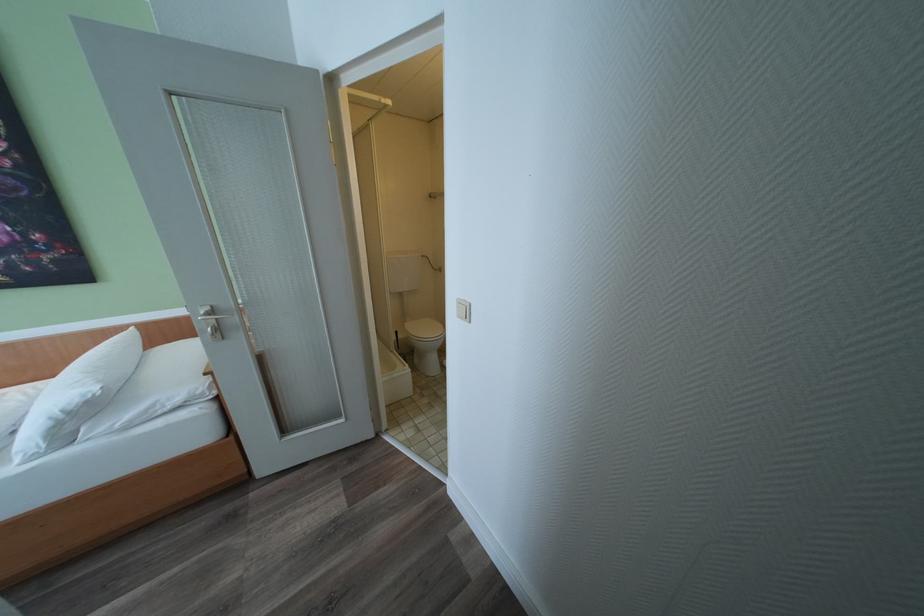
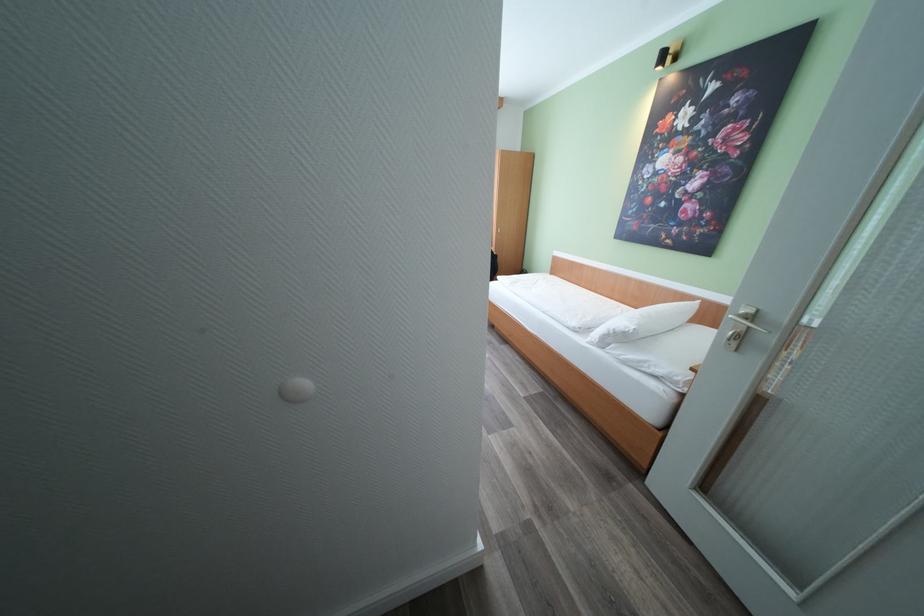
The point at (x=225, y=321) is marked in the first image. Where is the corresponding point in the second image?

(756, 329)